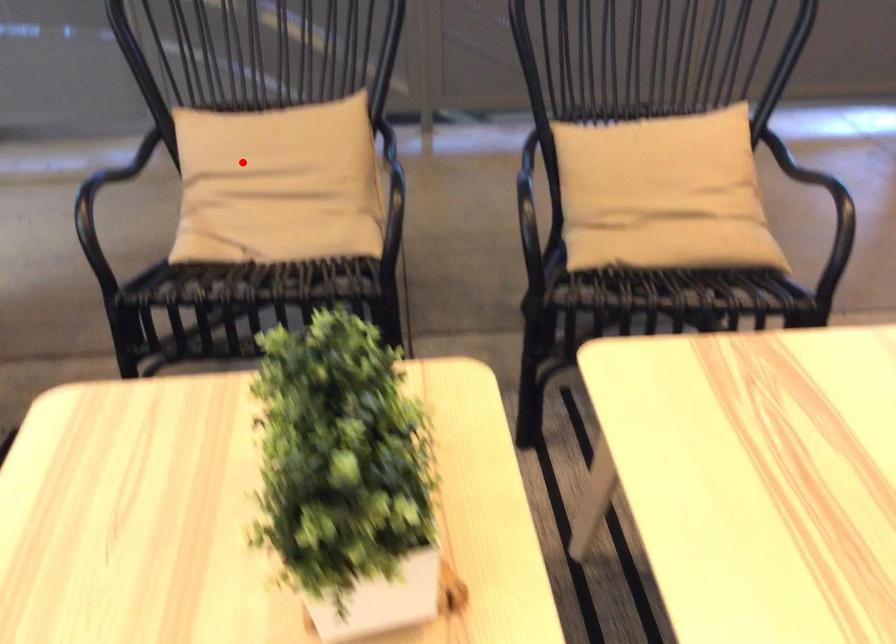
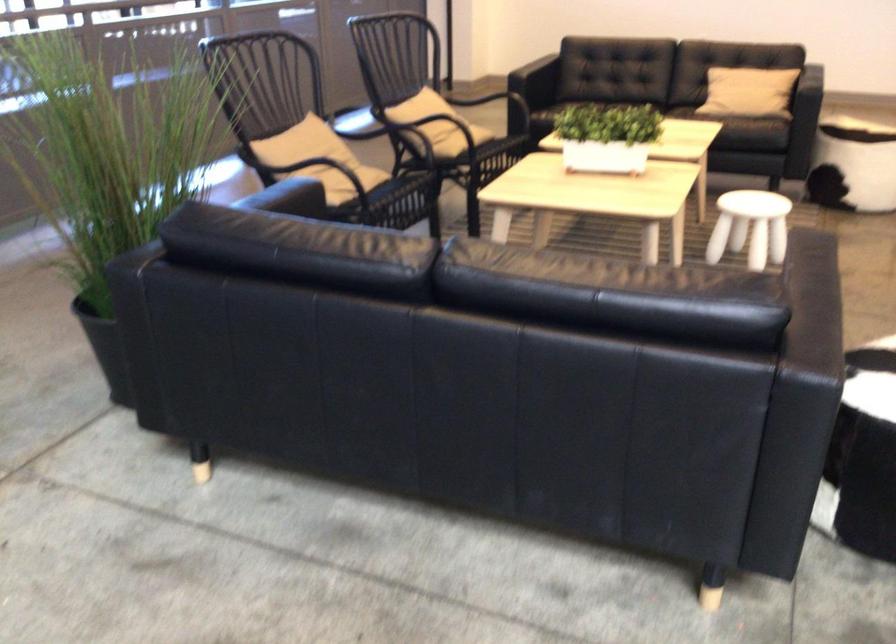
Question: I am providing you with two images of the same scene from different viewpoints. A red point is shown in image1. For the corresponding object point in image2, is it positioned nearer or farther from the camera?

Choices:
 (A) Nearer
 (B) Farther

Answer: (B)